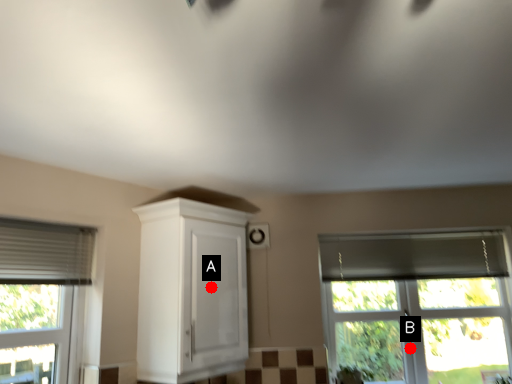
Question: Two points are circled on the image, labeled by A and B beside each circle. Which point appears farthest from the camera in this image?

Choices:
 (A) A is further
 (B) B is further

Answer: (B)